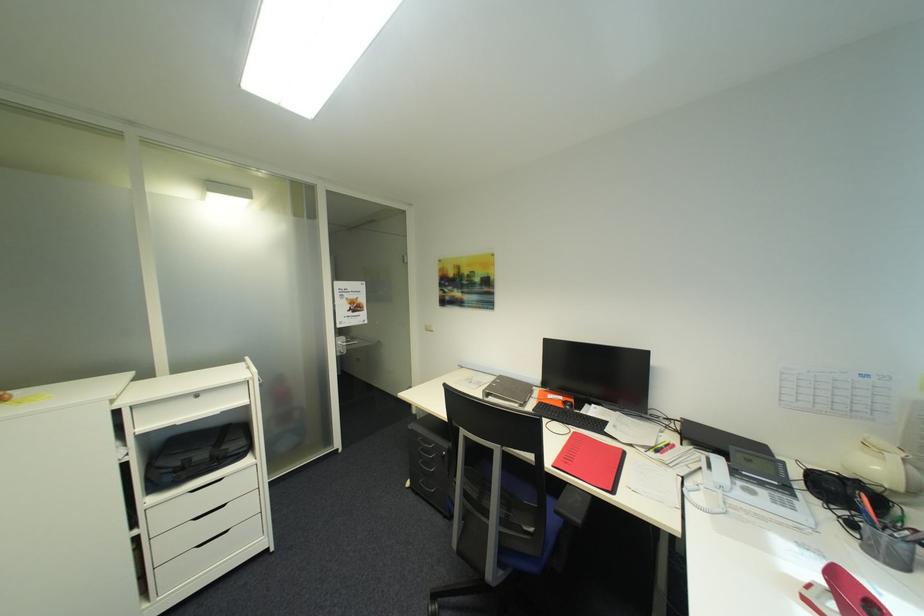
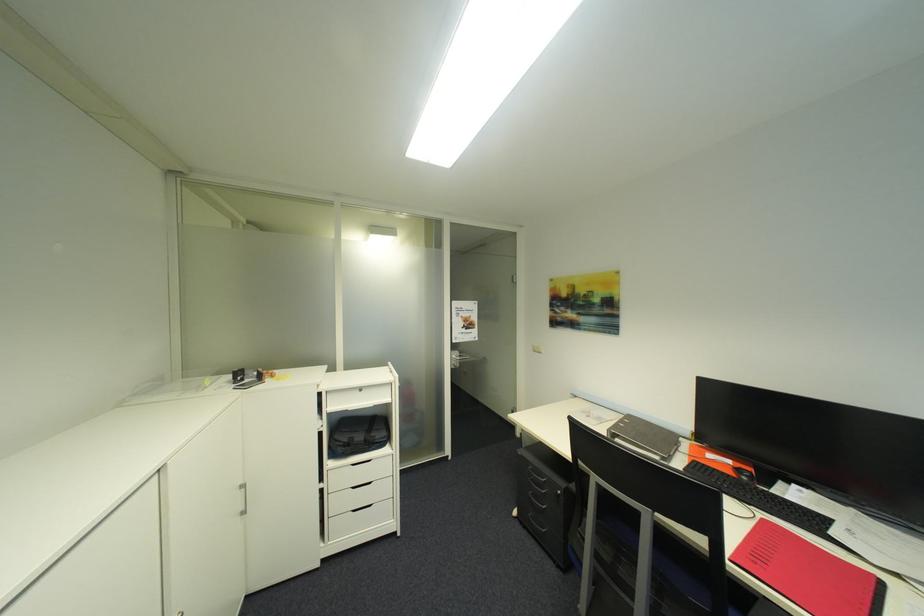
In the second image, find the point that corresponds to point (568, 399) in the first image.

(736, 463)